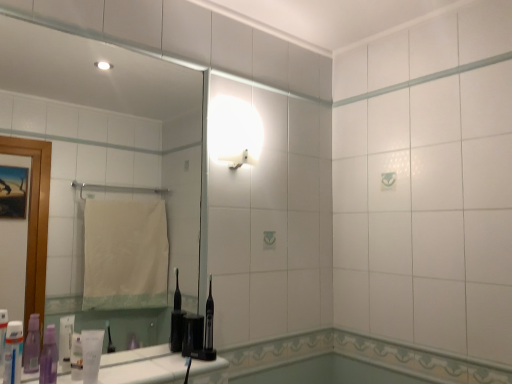
Question: Visually, is translucent plastic toothpaste tube at lower left, the first toiletry in the left-to-right sequence, positioned to the left or to the right of white glossy light fixture at upper center?

Choices:
 (A) right
 (B) left

Answer: (B)

Question: From a real-world perspective, is translucent plastic toothpaste tube at lower left, the first toiletry in the left-to-right sequence, positioned above or below white glossy light fixture at upper center?

Choices:
 (A) below
 (B) above

Answer: (A)

Question: Estimate the real-world distances between objects in this image. Which object is farther from the translucent plastic toothpaste tube at lower left, which is the second toiletry from right to left?

Choices:
 (A) purple plastic toothpaste at lower left, the 2th toiletry viewed from the left
 (B) white matte tube at lower left, acting as the first toiletry starting from the right
 (C) clear glass mirror at upper left
 (D) white glossy light fixture at upper center
 (E) translucent plastic toothpaste tube at lower left, the 4th toiletry viewed from the right

Answer: (C)

Question: Which of these objects is positioned farthest from the white glossy light fixture at upper center?

Choices:
 (A) translucent plastic toothpaste tube at lower left, which is the second toiletry from right to left
 (B) clear glass mirror at upper left
 (C) white matte tube at lower left, acting as the first toiletry starting from the right
 (D) translucent plastic toothpaste tube at lower left, the first toiletry in the left-to-right sequence
 (E) purple plastic toothpaste at lower left, the third toiletry in the right-to-left sequence

Answer: (B)